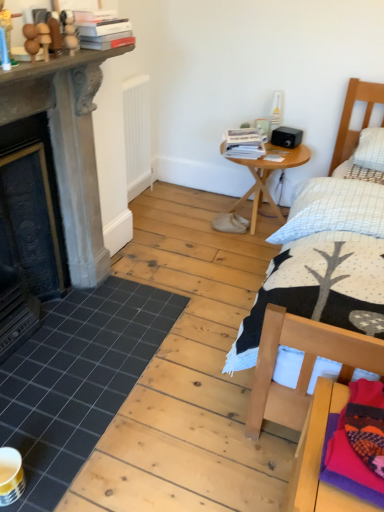
Question: Is hardcover book at upper left, the 1th book when ordered from left to right, bigger or smaller than knitted woolen blanket at lower right?

Choices:
 (A) big
 (B) small

Answer: (A)

Question: Does point (87, 41) appear closer or farther from the camera than point (342, 496)?

Choices:
 (A) farther
 (B) closer

Answer: (A)

Question: Estimate the real-world distances between objects in this image. Which object is farther from the white paper stack at upper right, placed as the third book when sorted from left to right?

Choices:
 (A) wooden bed at right
 (B) knitted woolen blanket at lower right
 (C) dark gray stone fireplace at left
 (D) white matte radiator at center
 (E) white paper book at upper center, the second book from the right

Answer: (B)

Question: Which object is positioned farthest from the white matte radiator at center?

Choices:
 (A) dark gray stone fireplace at left
 (B) wooden bed at right
 (C) white paper stack at upper right, the first book positioned from the right
 (D) white paper book at upper center, the second book in the left-to-right sequence
 (E) black tile at lower left

Answer: (B)